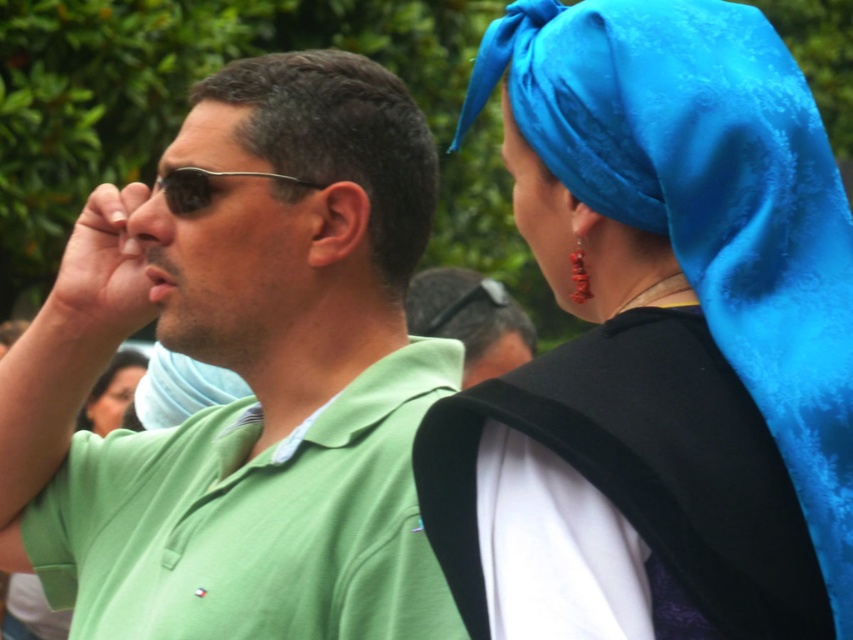
Question: Does satin blue headscarf at upper right appear on the left side of blue satin headscarf at upper right?

Choices:
 (A) no
 (B) yes

Answer: (A)

Question: Which point is closer to the camera?

Choices:
 (A) (73, 317)
 (B) (109, 369)
 (C) (820, 337)

Answer: (C)

Question: Among these points, which one is farthest from the camera?

Choices:
 (A) (122, 394)
 (B) (207, 216)

Answer: (A)

Question: Can you confirm if blue satin headscarf at upper right is positioned above smooth black hair at lower left?

Choices:
 (A) yes
 (B) no

Answer: (A)

Question: Among these points, which one is nearest to the camera?

Choices:
 (A) (381, 83)
 (B) (573, 627)
 (C) (515, 140)

Answer: (B)

Question: Is green matte shirt at center to the right of matte black forehead at upper center from the viewer's perspective?

Choices:
 (A) no
 (B) yes

Answer: (B)